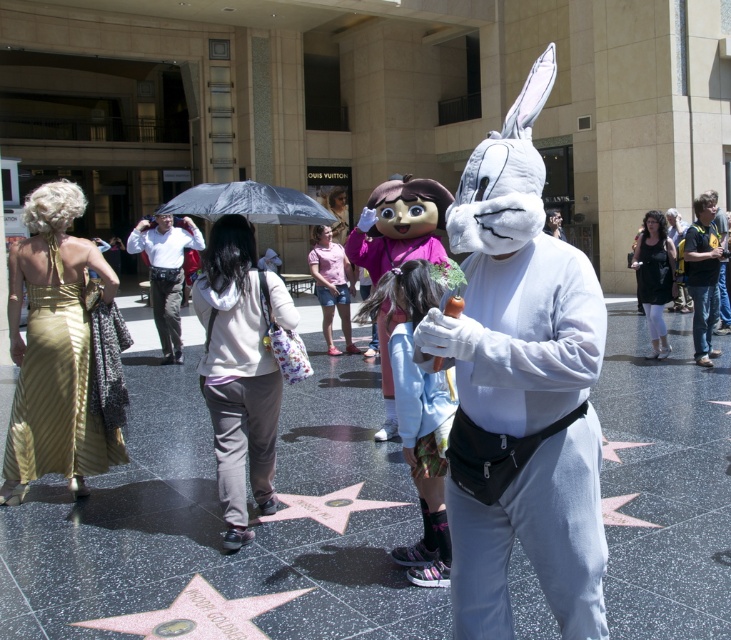
Question: Which of the following is the farthest from the observer?

Choices:
 (A) coord(143,230)
 (B) coord(268,516)
 (C) coord(238,364)

Answer: (A)

Question: Which point is farther from the camera taking this photo?

Choices:
 (A) (231, 406)
 (B) (175, 228)
 (C) (12, 433)

Answer: (B)

Question: Is gold satin dress at left in front of white cotton shirt at center?

Choices:
 (A) yes
 (B) no

Answer: (A)

Question: Can you confirm if light gray fleece hoodie at center is positioned above black matte dress at center?

Choices:
 (A) yes
 (B) no

Answer: (B)

Question: Among these objects, which one is farthest from the camera?

Choices:
 (A) gold satin dress at left
 (B) gold reflective star at center
 (C) pink denim shorts at center
 (D) light gray fleece hoodie at center

Answer: (C)

Question: Can you confirm if gold satin dress at left is bigger than fluffy pink bunny at center?

Choices:
 (A) no
 (B) yes

Answer: (B)